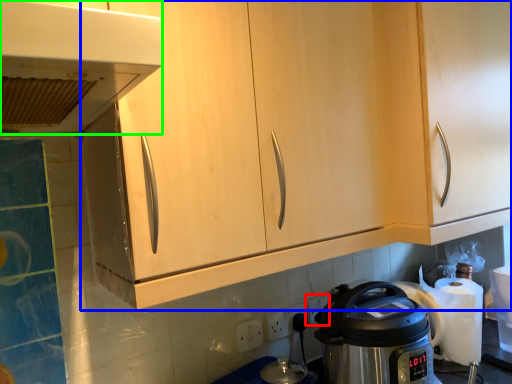
Question: Which is farther away from electric outlet (highlighted by a red box)? cabinetry (highlighted by a blue box) or home appliance (highlighted by a green box)?

Choices:
 (A) cabinetry
 (B) home appliance

Answer: (B)